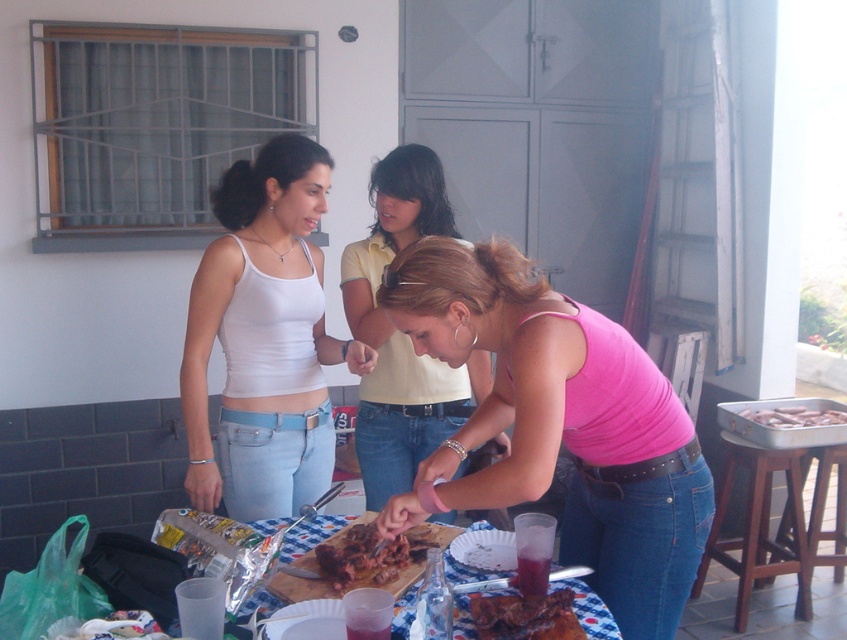
You are a guest at the gathering and want to ask the person wearing the white matte tank top at center for the brown matte sausages at right. Which direction should you walk to approach them?

The white matte tank top at center is to the left of the brown matte sausages at right, so you should walk to the left to approach them.

Consider the image. You are a guest at the gathering and want to ask the person wearing the pink fabric shirt at center for a piece of the brown matte sausages at right. Which direction should you approach from to reach them?

The pink fabric shirt at center is positioned on the left side of brown matte sausages at right, so you should approach from the left side of the brown matte sausages at right to reach the person wearing the pink fabric shirt at center.